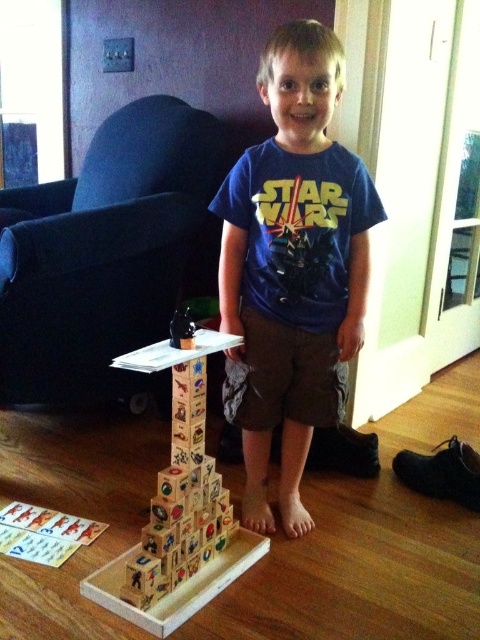
Question: Which point appears farthest from the camera in this image?

Choices:
 (A) (220, 580)
 (B) (268, 67)

Answer: (B)

Question: Can you confirm if blue cotton shirt at center is positioned to the right of wooden blocks at center?

Choices:
 (A) no
 (B) yes

Answer: (B)

Question: Can you confirm if blue cotton shirt at center is wider than wooden blocks at center?

Choices:
 (A) no
 (B) yes

Answer: (B)

Question: Which point is closer to the camera?

Choices:
 (A) blue cotton shirt at center
 (B) wooden blocks at center

Answer: (B)

Question: Observing the image, what is the correct spatial positioning of blue cotton shirt at center in reference to wooden blocks at center?

Choices:
 (A) right
 (B) left

Answer: (A)

Question: Which point is farther from the camera taking this photo?

Choices:
 (A) (321, 230)
 (B) (196, 355)

Answer: (A)